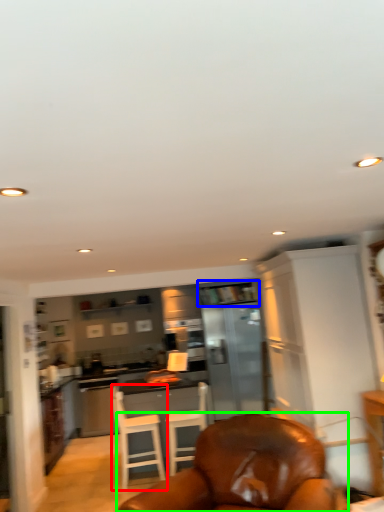
Question: Which object is positioned farthest from chair (highlighted by a red box)? Select from shelf (highlighted by a blue box) and chair (highlighted by a green box).

Choices:
 (A) shelf
 (B) chair

Answer: (B)